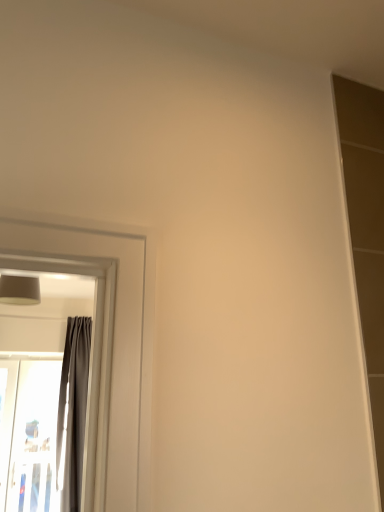
Question: Is the depth of gray fabric curtain at left less than that of transparent plastic screen door at left?

Choices:
 (A) no
 (B) yes

Answer: (B)

Question: Can you confirm if gray fabric curtain at left is shorter than transparent plastic screen door at left?

Choices:
 (A) yes
 (B) no

Answer: (B)

Question: From the image's perspective, would you say gray fabric curtain at left is shown under transparent plastic screen door at left?

Choices:
 (A) yes
 (B) no

Answer: (B)

Question: Does gray fabric curtain at left have a greater height compared to transparent plastic screen door at left?

Choices:
 (A) no
 (B) yes

Answer: (B)

Question: Are gray fabric curtain at left and transparent plastic screen door at left far apart?

Choices:
 (A) yes
 (B) no

Answer: (B)

Question: From a real-world perspective, is gray fabric curtain at left under transparent plastic screen door at left?

Choices:
 (A) yes
 (B) no

Answer: (B)

Question: Does transparent plastic screen door at left have a lesser height compared to matte gray lampshade at upper left?

Choices:
 (A) no
 (B) yes

Answer: (A)

Question: Does transparent plastic screen door at left appear on the right side of matte gray lampshade at upper left?

Choices:
 (A) no
 (B) yes

Answer: (A)

Question: From the image's perspective, is transparent plastic screen door at left on top of matte gray lampshade at upper left?

Choices:
 (A) yes
 (B) no

Answer: (B)

Question: Can you confirm if transparent plastic screen door at left is taller than matte gray lampshade at upper left?

Choices:
 (A) no
 (B) yes

Answer: (B)

Question: Would you say transparent plastic screen door at left is outside matte gray lampshade at upper left?

Choices:
 (A) yes
 (B) no

Answer: (A)

Question: From a real-world perspective, is transparent plastic screen door at left on top of matte gray lampshade at upper left?

Choices:
 (A) yes
 (B) no

Answer: (B)

Question: From a real-world perspective, is matte gray lampshade at upper left located beneath gray fabric curtain at left?

Choices:
 (A) no
 (B) yes

Answer: (A)